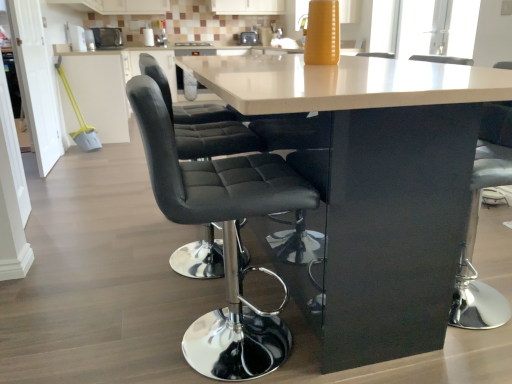
Question: From a real-world perspective, is metallic silver toaster at upper left, acting as the 2th appliance starting from the right, physically located above or below metallic silver toaster at center, arranged as the second appliance when viewed from the left?

Choices:
 (A) below
 (B) above

Answer: (B)

Question: Does point (101, 46) appear closer or farther from the camera than point (246, 34)?

Choices:
 (A) farther
 (B) closer

Answer: (A)

Question: Which of these objects is positioned closest to the metallic silver toaster at center, arranged as the second appliance when viewed from the left?

Choices:
 (A) glossy black table at center
 (B) black leather chair at center
 (C) white glossy counter at center
 (D) white glossy cabinet at upper left
 (E) metallic silver toaster at upper left, which appears as the first appliance when viewed from the front

Answer: (E)

Question: Which object is the farthest from the metallic silver toaster at center, acting as the 1th appliance starting from the back?

Choices:
 (A) white glossy cabinet at upper left
 (B) glossy black table at center
 (C) black leather chair at center
 (D) metallic silver toaster at upper left, which appears as the first appliance when viewed from the front
 (E) white glossy counter at center

Answer: (C)